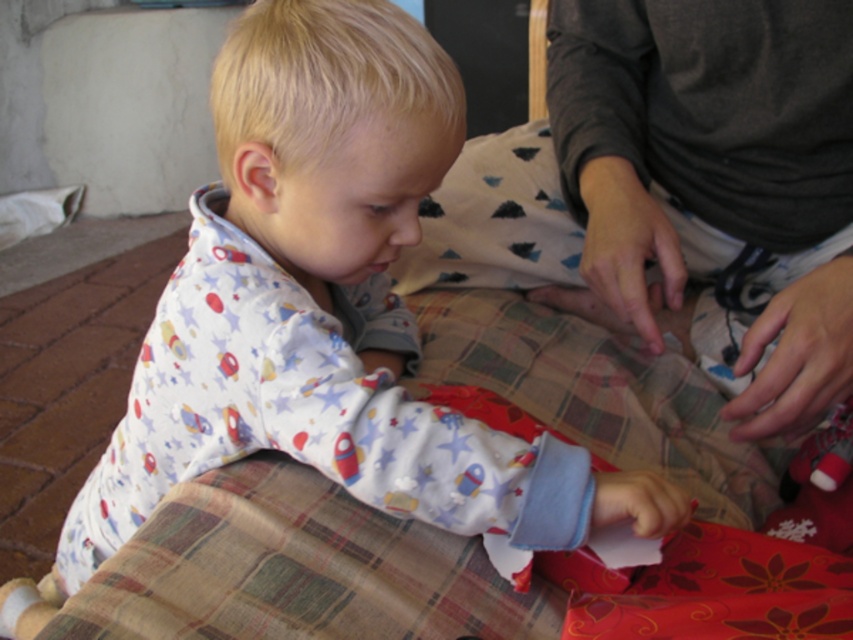
Does white cotton pajamas at center have a smaller size compared to dark gray fabric at center?

No.

Which is behind, point (430, 406) or point (752, 330)?

Point (752, 330)

Identify the location of white cotton pajamas at center. This screenshot has width=853, height=640. (326, 307).

The width and height of the screenshot is (853, 640). Find the location of `white cotton pajamas at center`. white cotton pajamas at center is located at coordinates (326, 307).